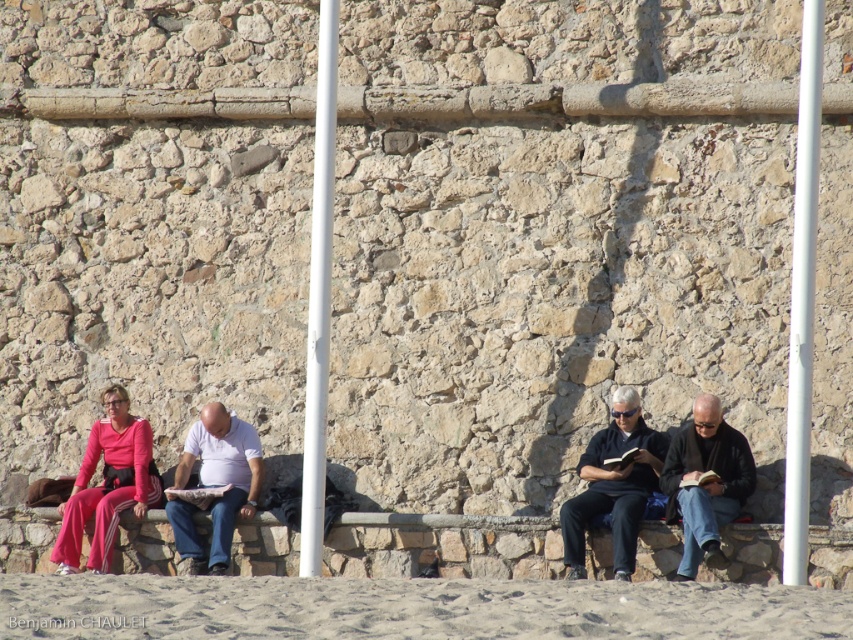
You are standing on the sandy area and looking towards the stone wall. Which of the two, the dark blue shirt at center or the pink fabric pants at left, is higher in elevation?

The dark blue shirt at center is located above the pink fabric pants at left, so it has a higher elevation.

You are standing at the camera position looking at the beach scene. There are two points marked in the image. Which point, point (405,602) or point (218,417), is closer to you?

Point (405,602) is closer to the camera than point (218,417).